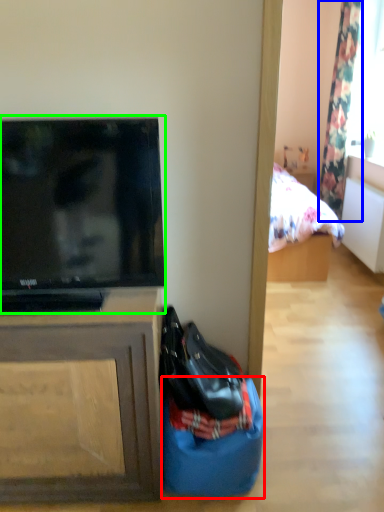
Question: Estimate the real-world distances between objects in this image. Which object is closer to sack (highlighted by a red box), curtain (highlighted by a blue box) or television (highlighted by a green box)?

Choices:
 (A) curtain
 (B) television

Answer: (B)